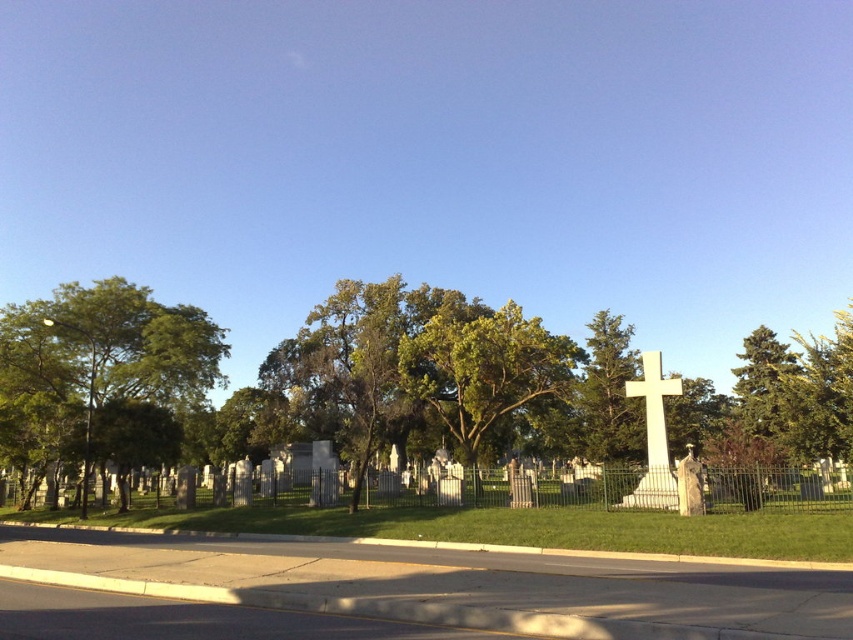
Question: Among these points, which one is nearest to the camera?

Choices:
 (A) (508, 404)
 (B) (650, 458)
 (C) (112, 376)

Answer: (B)

Question: Is green leafy tree at left behind green leafy tree at center?

Choices:
 (A) no
 (B) yes

Answer: (A)

Question: Can you confirm if green leafy tree at center is positioned to the left of white marble cross at right?

Choices:
 (A) yes
 (B) no

Answer: (A)

Question: Which is nearer to the white marble cross at right?

Choices:
 (A) green leafy tree at center
 (B) green leafy tree at left

Answer: (A)

Question: Is green leafy tree at left bigger than green leafy tree at center?

Choices:
 (A) no
 (B) yes

Answer: (B)

Question: Considering the real-world distances, which object is closest to the green leafy tree at left?

Choices:
 (A) white marble cross at right
 (B) green leafy tree at center

Answer: (B)